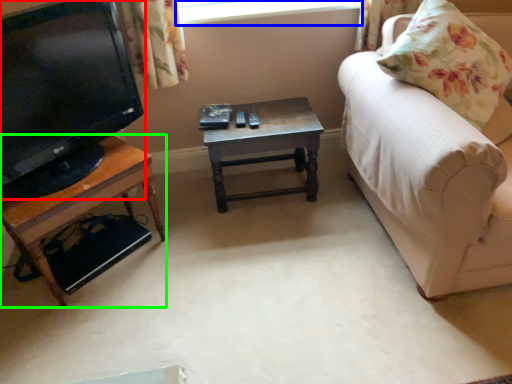
Question: Based on their relative distances, which object is farther from television (highlighted by a red box)? Choose from window screen (highlighted by a blue box) and table (highlighted by a green box).

Choices:
 (A) window screen
 (B) table

Answer: (A)